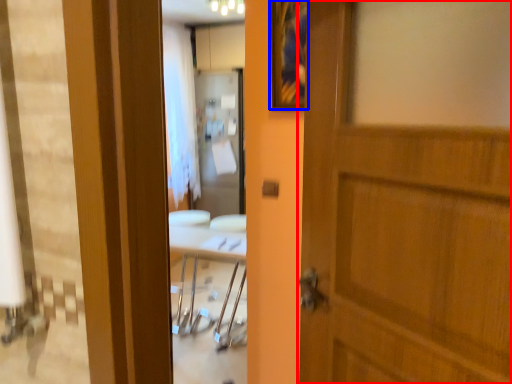
Question: Which object appears closest to the camera in this image, door (highlighted by a red box) or picture frame (highlighted by a blue box)?

Choices:
 (A) door
 (B) picture frame

Answer: (A)